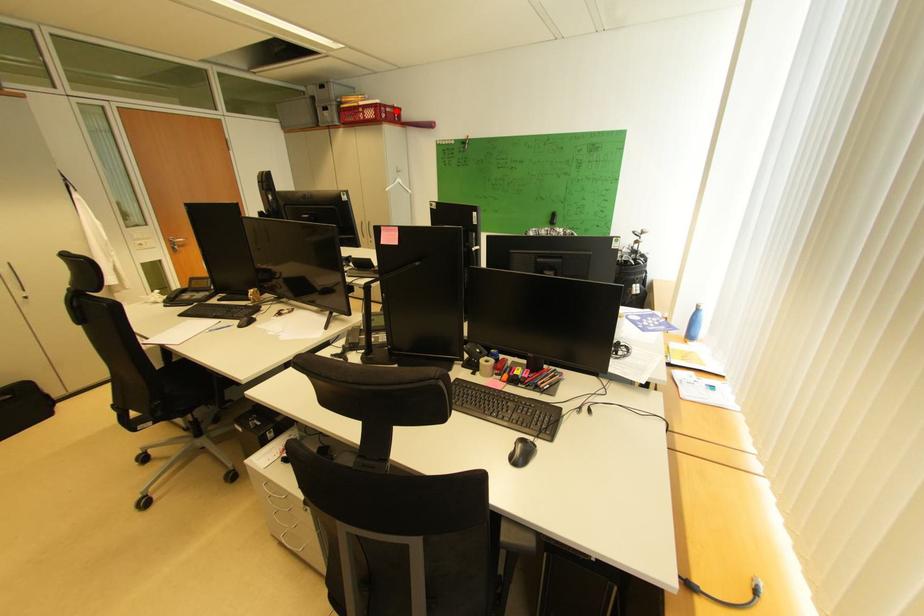
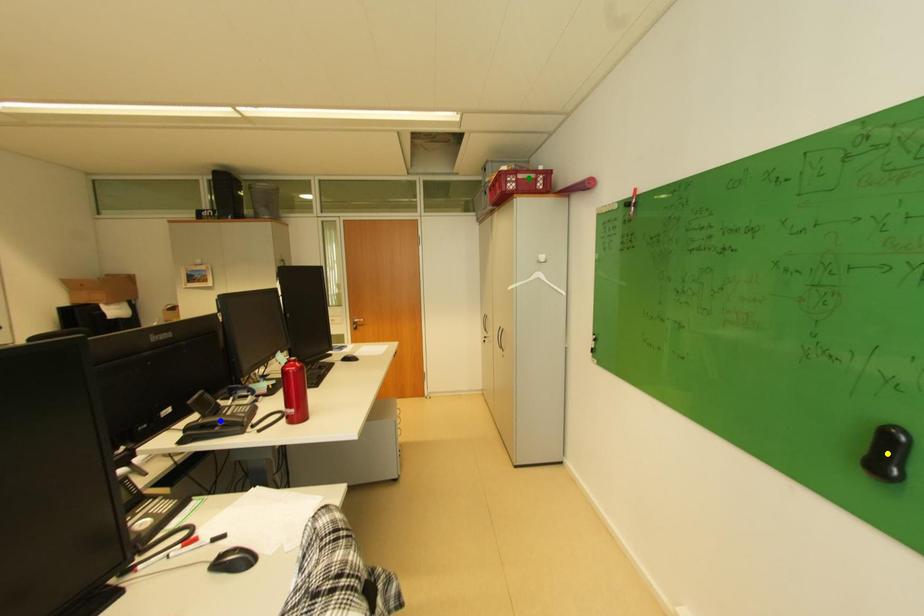
Question: I am providing you with two images of the same scene from different viewpoints. A red point is marked on the first image. You are given multiple points on the second image. Which point in image 2 is actually the same real-world point as the red point in image 1?

Choices:
 (A) green point
 (B) blue point
 (C) yellow point

Answer: (A)